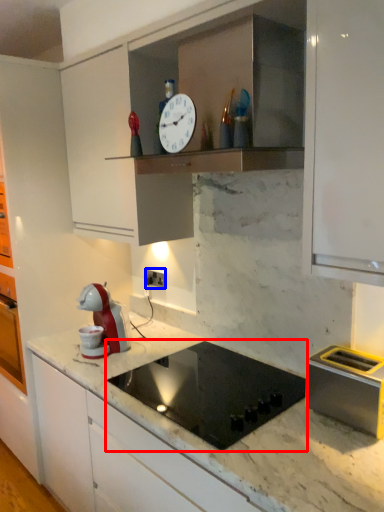
Question: Which of the following is the farthest to the observer, gas stove (highlighted by a red box) or electric outlet (highlighted by a blue box)?

Choices:
 (A) gas stove
 (B) electric outlet

Answer: (B)